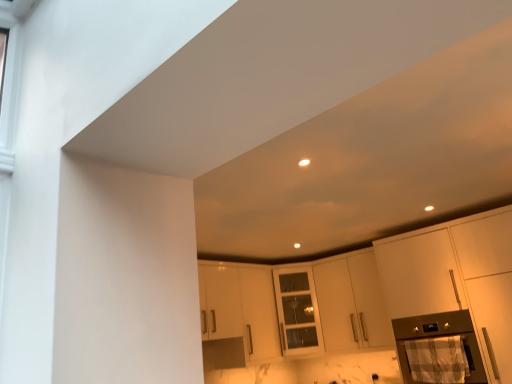
Question: From a real-world perspective, is matte white cabinet at right, arranged as the 1th cabinetry when viewed from the front, positioned under metallic stainless steel oven at lower right based on gravity?

Choices:
 (A) yes
 (B) no

Answer: (B)

Question: Is matte white cabinet at right, arranged as the 1th cabinetry when viewed from the front, to the right of metallic stainless steel oven at lower right from the viewer's perspective?

Choices:
 (A) yes
 (B) no

Answer: (A)

Question: Considering the relative sizes of matte white cabinet at right, arranged as the 1th cabinetry when viewed from the front, and metallic stainless steel oven at lower right in the image provided, is matte white cabinet at right, arranged as the 1th cabinetry when viewed from the front, smaller than metallic stainless steel oven at lower right?

Choices:
 (A) no
 (B) yes

Answer: (A)

Question: From the image's perspective, is matte white cabinet at right, arranged as the 1th cabinetry when viewed from the front, beneath metallic stainless steel oven at lower right?

Choices:
 (A) no
 (B) yes

Answer: (A)

Question: Can you confirm if matte white cabinet at right, arranged as the 1th cabinetry when viewed from the front, is wider than metallic stainless steel oven at lower right?

Choices:
 (A) yes
 (B) no

Answer: (A)

Question: Does matte white cabinet at right, arranged as the 1th cabinetry when viewed from the front, turn towards metallic stainless steel oven at lower right?

Choices:
 (A) no
 (B) yes

Answer: (B)

Question: Is white matte cabinet at center, the first cabinetry in the back-to-front sequence, to the right of metallic stainless steel oven at lower right from the viewer's perspective?

Choices:
 (A) yes
 (B) no

Answer: (B)

Question: From a real-world perspective, is white matte cabinet at center, positioned as the second cabinetry in front-to-back order, positioned over metallic stainless steel oven at lower right based on gravity?

Choices:
 (A) no
 (B) yes

Answer: (B)

Question: Is white matte cabinet at center, the first cabinetry in the back-to-front sequence, next to metallic stainless steel oven at lower right?

Choices:
 (A) no
 (B) yes

Answer: (A)

Question: From a real-world perspective, is white matte cabinet at center, positioned as the second cabinetry in front-to-back order, located beneath metallic stainless steel oven at lower right?

Choices:
 (A) yes
 (B) no

Answer: (B)

Question: Does white matte cabinet at center, the first cabinetry in the back-to-front sequence, lie behind metallic stainless steel oven at lower right?

Choices:
 (A) no
 (B) yes

Answer: (B)

Question: Can you confirm if white matte cabinet at center, the first cabinetry in the back-to-front sequence, is taller than metallic stainless steel oven at lower right?

Choices:
 (A) no
 (B) yes

Answer: (B)

Question: Is metallic stainless steel oven at lower right not within matte white cabinet at right, which is the second cabinetry in back-to-front order?

Choices:
 (A) no
 (B) yes

Answer: (A)